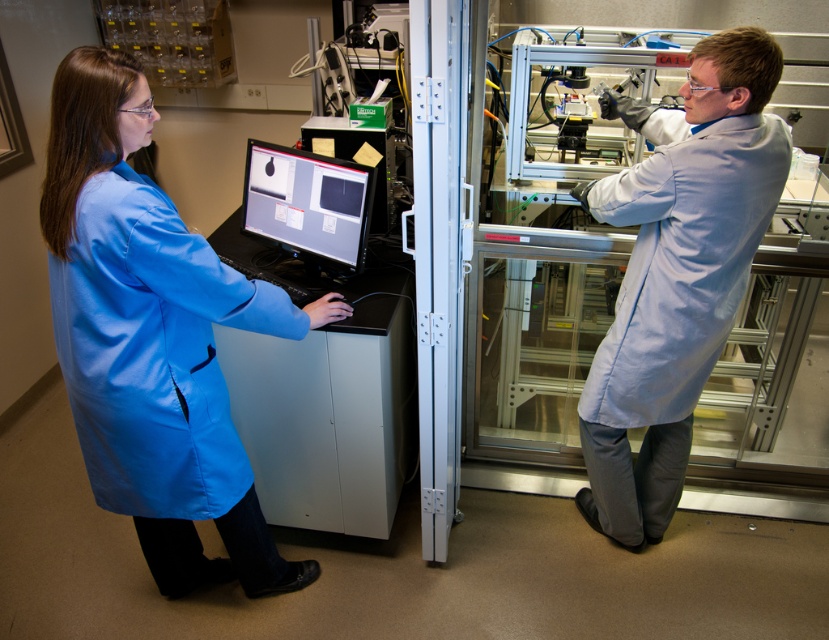
You are a delivery robot in a lab. You need to deliver a package to the person at point (634, 342). The other person is at point 0.3, 0.4. If you can carry the package only 2 meters, can you reach the destination without dropping it?

The two points are 2.06 meters apart, which is slightly more than the robot can carry the package for 2 meters. Therefore, the robot cannot reach the destination without dropping the package.

You are a researcher in this lab and need to locate your blue matte lab coat at center. According to the coordinates given, where should you look?

The blue matte lab coat at center is located at point (153, 337).

You are a new lab assistant and need to choose a lab coat to wear. You see the blue matte lab coat at center and the light blue lab coat at right. Which lab coat is bigger in size?

The blue matte lab coat at center is larger in size than the light blue lab coat at right, so you should choose the blue matte lab coat at center.